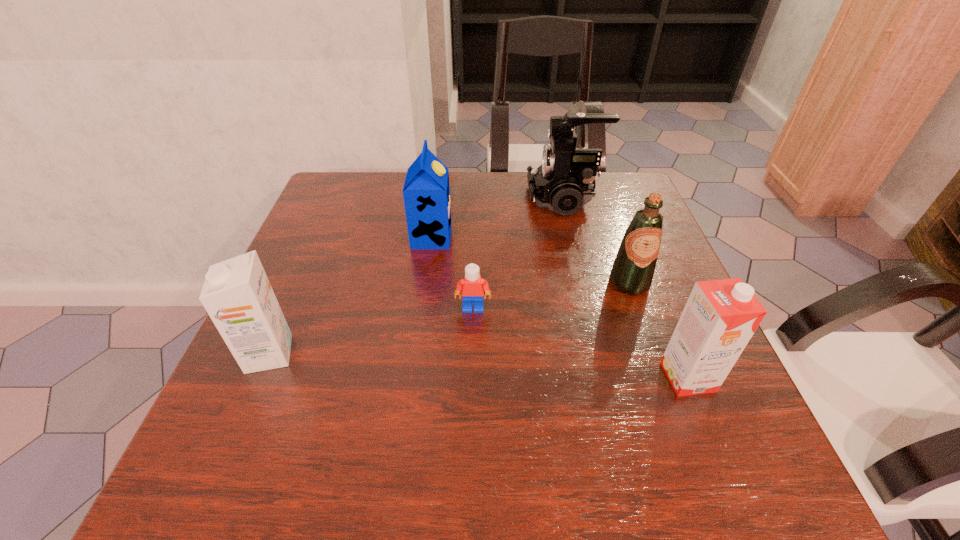
Identify the location of camcorder. The image size is (960, 540). (564, 182).

Identify the location of the farthest carton. The width and height of the screenshot is (960, 540). (426, 192).

At what (x,y) coordinates should I click in order to perform the action: click on the fifth nearest object. Please return your answer as a coordinate pair (x, y). Looking at the image, I should click on (426, 192).

The width and height of the screenshot is (960, 540). Find the location of `olive oil`. olive oil is located at coordinates (632, 272).

Where is `the rightmost carton`? This screenshot has height=540, width=960. the rightmost carton is located at coordinates (720, 317).

Identify the location of the leftmost object. The height and width of the screenshot is (540, 960). pos(237,295).

In order to click on the shortest object in this screenshot , I will do `click(472, 288)`.

Find the location of a particular element. This screenshot has height=540, width=960. the fourth farthest object is located at coordinates (472, 288).

I want to click on vacant point located 0.140m on the lens mount of the farthest object, so click(475, 199).

The image size is (960, 540). What are the coordinates of `vacant space located on the lens mount of the farthest object` in the screenshot? It's located at (445, 199).